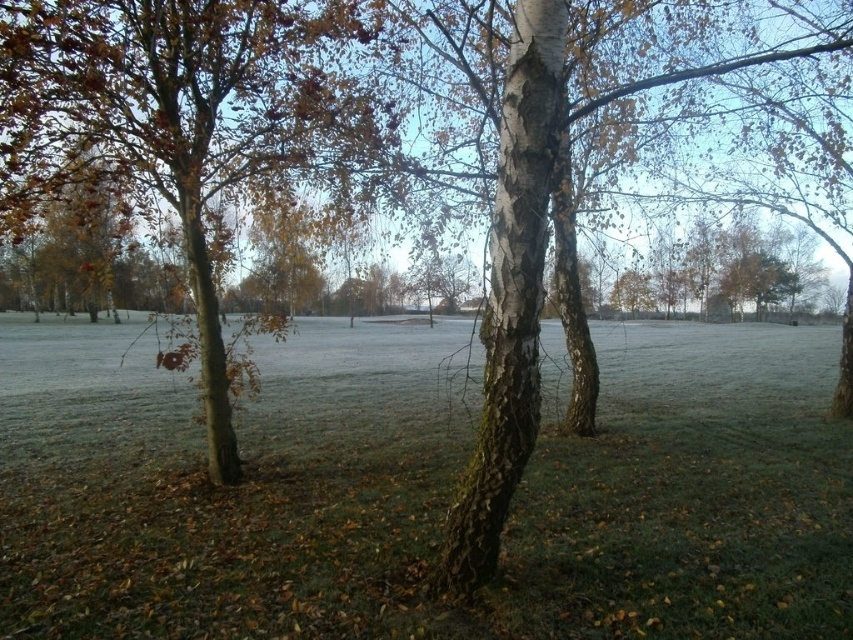
You are a gardener planning to plant a new flower bed between the green grass at center and the brown rough bark tree at left. The flower bed requires a minimum of 10 feet of space. Based on the scene, will there be enough space for the flower bed?

The green grass at center is 9.65 feet from the brown rough bark tree at left, which is less than the required 10 feet. Therefore, there is not enough space for the flower bed.

You are planning to set up a small tent in the area shown in the image. Given that the green grass at center and the brown rough bark tree at left are present, which location would provide more space for the tent? Please explain your reasoning based on the scene description.

The green grass at center has a larger size compared to the brown rough bark tree at left, so setting up the tent on the green grass at center would provide more space since it is bigger in area than the area occupied by the brown rough bark tree at left.